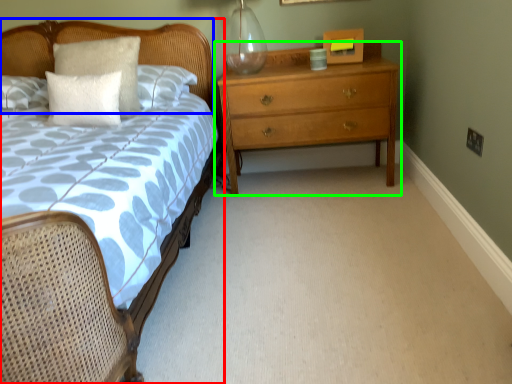
Question: Which object is the farthest from bed (highlighted by a red box)? Choose among these: headboard (highlighted by a blue box) or chest of drawers (highlighted by a green box).

Choices:
 (A) headboard
 (B) chest of drawers

Answer: (B)